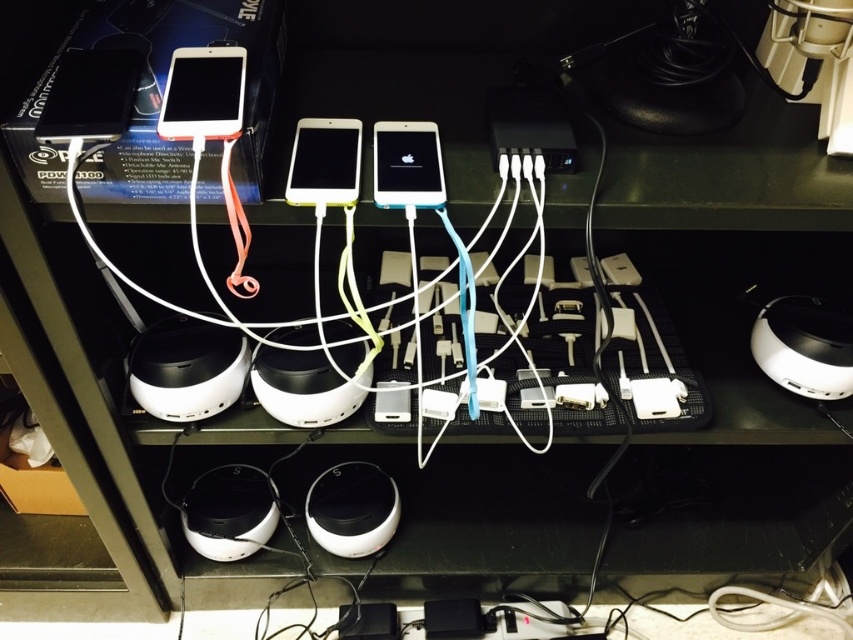
Question: Can you confirm if white matte phone at center is wider than white glossy iphone at center?

Choices:
 (A) yes
 (B) no

Answer: (B)

Question: Can you confirm if matte black phone at upper left is thinner than white glossy iphone at center?

Choices:
 (A) yes
 (B) no

Answer: (B)

Question: Is matte black phone at upper left further to camera compared to white matte phone at center?

Choices:
 (A) no
 (B) yes

Answer: (A)

Question: Which object is positioned closest to the matte white tablet at upper left?

Choices:
 (A) matte black phone at upper left
 (B) white glossy iphone at center

Answer: (A)

Question: Which object appears closest to the camera in this image?

Choices:
 (A) matte black phone at upper left
 (B) white glossy iphone at center
 (C) white matte phone at center

Answer: (A)

Question: Which of these objects is positioned closest to the matte white tablet at upper left?

Choices:
 (A) white glossy iphone at center
 (B) matte black phone at upper left
 (C) white matte phone at center

Answer: (B)